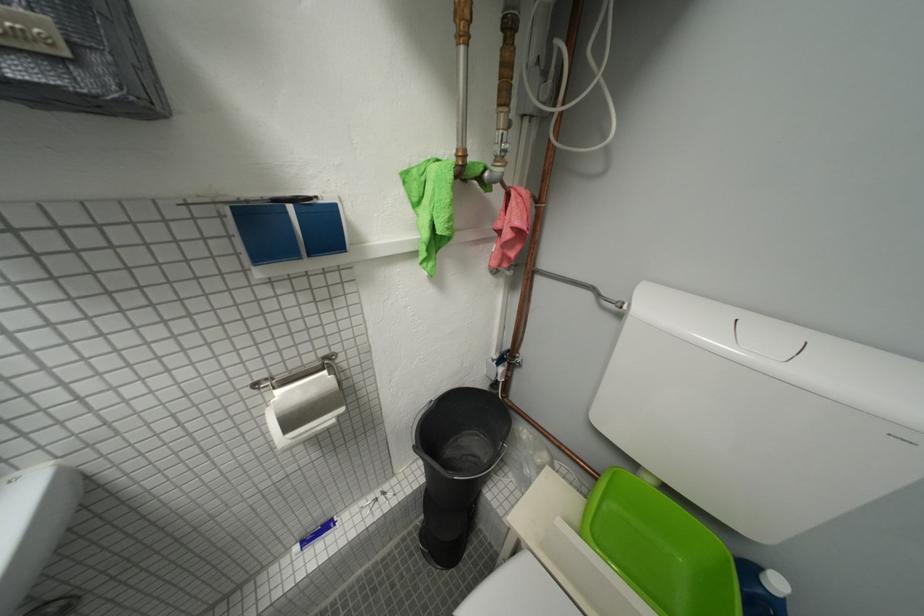
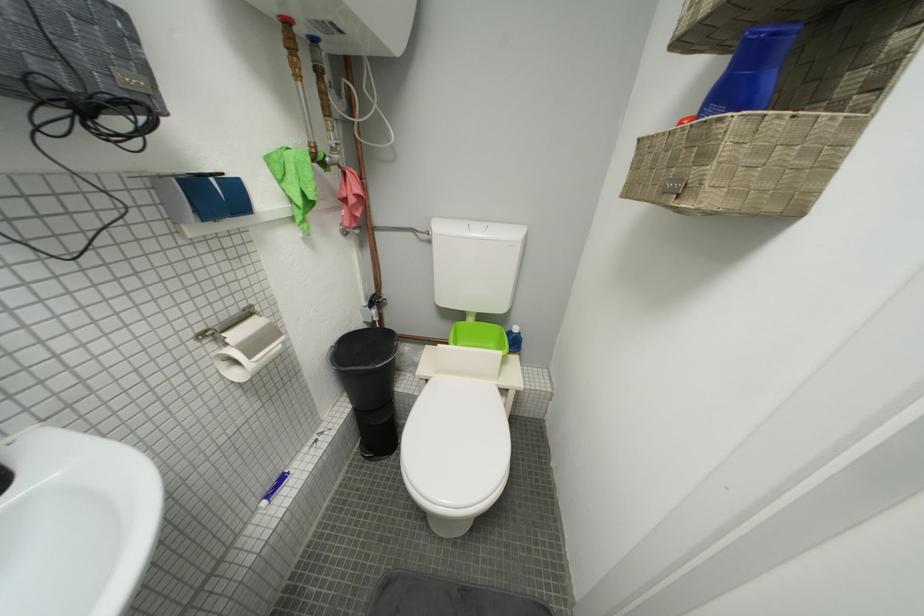
Question: The camera is either moving clockwise (left) or counter-clockwise (right) around the object. The first image is from the beginning of the video and the second image is from the end. Is the camera moving left or right when shooting the video?

Choices:
 (A) Left
 (B) Right

Answer: (A)